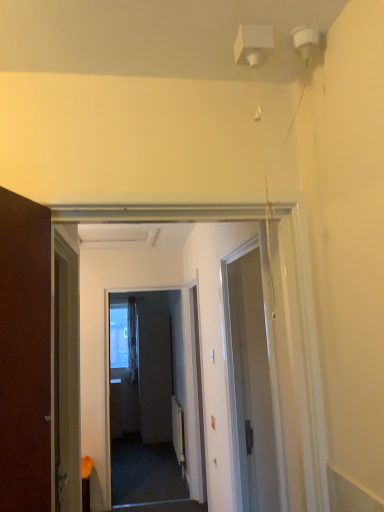
Question: In terms of width, does white sheer curtain at center look wider or thinner when compared to matte gray screen door at center?

Choices:
 (A) wide
 (B) thin

Answer: (B)

Question: Would you say white sheer curtain at center is inside or outside matte gray screen door at center?

Choices:
 (A) outside
 (B) inside

Answer: (A)

Question: Which is farther from the white glossy door at center?

Choices:
 (A) matte gray screen door at center
 (B) white sheer curtain at center

Answer: (B)

Question: Which of these objects is positioned closest to the matte gray screen door at center?

Choices:
 (A) white sheer curtain at center
 (B) white glossy door at center

Answer: (A)